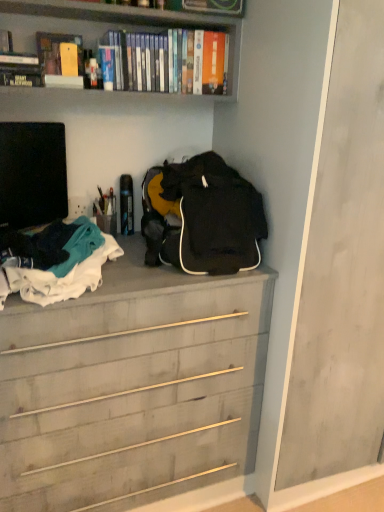
Question: Considering their positions, is white cotton clothes at left located in front of or behind hardcover books at upper center, marked as the fourth book in a left-to-right arrangement?

Choices:
 (A) behind
 (B) front

Answer: (B)

Question: From a real-world perspective, is white cotton clothes at left above or below hardcover books at upper center, marked as the fourth book in a left-to-right arrangement?

Choices:
 (A) below
 (B) above

Answer: (A)

Question: Which of these objects is positioned farthest from the hardcover books at upper center, which ranks as the first book in right-to-left order?

Choices:
 (A) black matte television at left
 (B) matte yellow book at upper left, which is the 2th book in right-to-left order
 (C) wooden chest of drawers at center
 (D) hardcover book at upper left, which appears as the fourth book when viewed from the right
 (E) hardcover book at upper left, the 2th book from the left

Answer: (C)

Question: Which is nearer to the white cotton clothes at left?

Choices:
 (A) wooden chest of drawers at center
 (B) matte yellow book at upper left, placed as the 3th book when sorted from left to right
 (C) hardcover book at upper left, positioned as the third book in right-to-left order
 (D) black matte television at left
 (E) hardcover book at upper left, which appears as the fourth book when viewed from the right

Answer: (D)